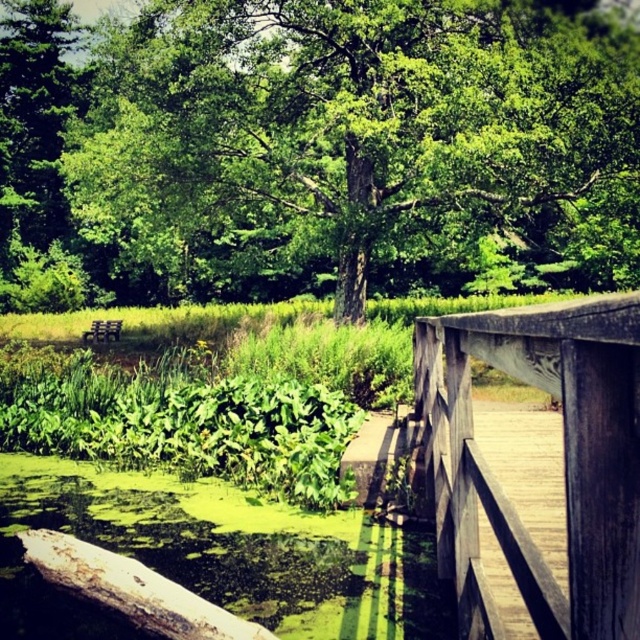
At what (x,y) coordinates should I click in order to perform the action: click on green leafy tree at center. Please return your answer as a coordinate pair (x, y). Looking at the image, I should click on (320, 145).

Does point (120, 28) come behind point (557, 611)?

Yes.

Where is `green leafy tree at center`? green leafy tree at center is located at coordinates 320,145.

Can you confirm if wooden rail at center is taller than wooden bridge at right?

Yes.

Does wooden rail at center have a lesser width compared to wooden bridge at right?

Incorrect, wooden rail at center's width is not less than wooden bridge at right's.

Is point (477, 496) in front of point (557, 442)?

That is True.

This screenshot has width=640, height=640. I want to click on wooden rail at center, so click(x=563, y=461).

Does green leafy tree at center appear under wooden bridge at right?

Actually, green leafy tree at center is above wooden bridge at right.

At what (x,y) coordinates should I click in order to perform the action: click on green leafy tree at center. Please return your answer as a coordinate pair (x, y). This screenshot has height=640, width=640. Looking at the image, I should click on (320, 145).

Locate an element on the screen. The width and height of the screenshot is (640, 640). green leafy tree at center is located at coordinates (320, 145).